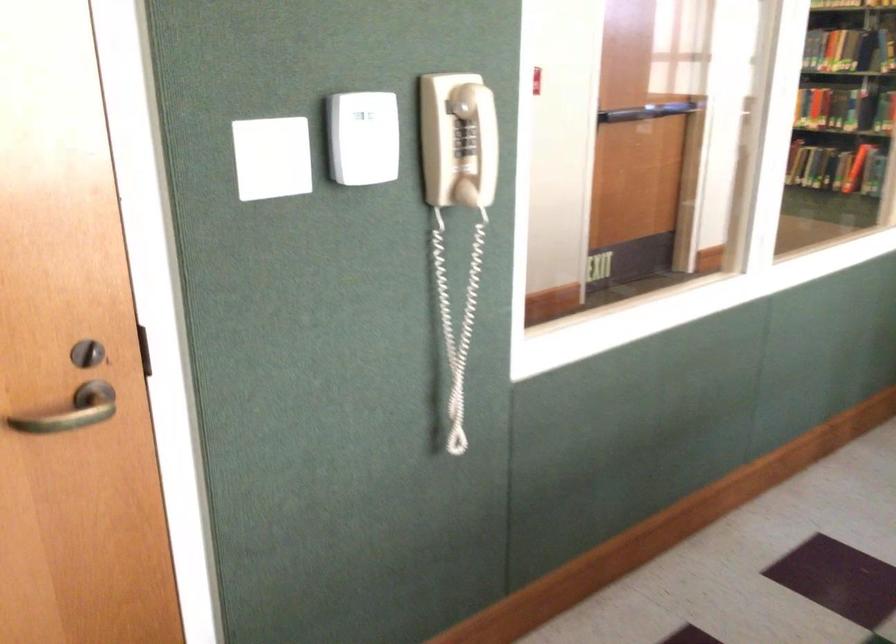
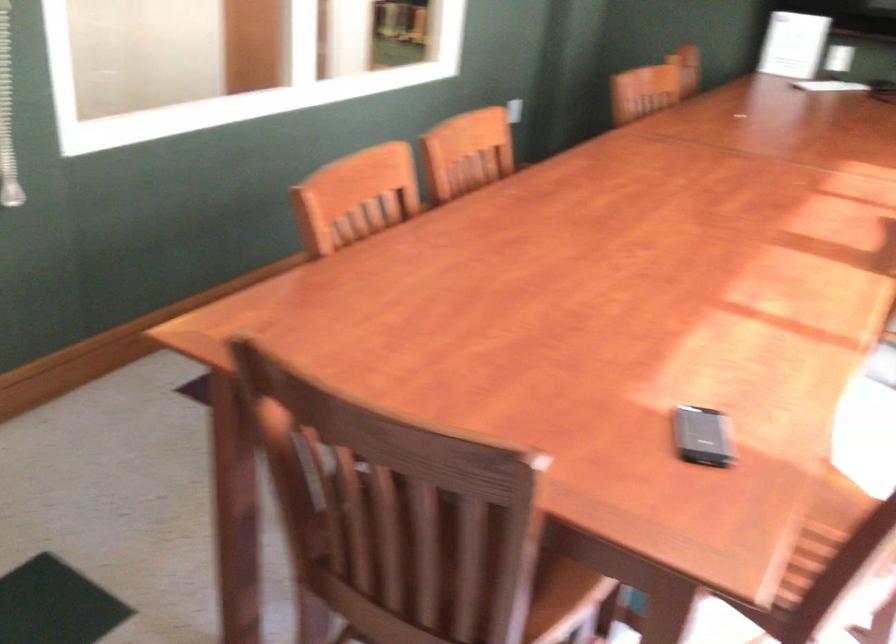
What movement of the cameraman would produce the second image?

The movement direction of the cameraman is right, backward.